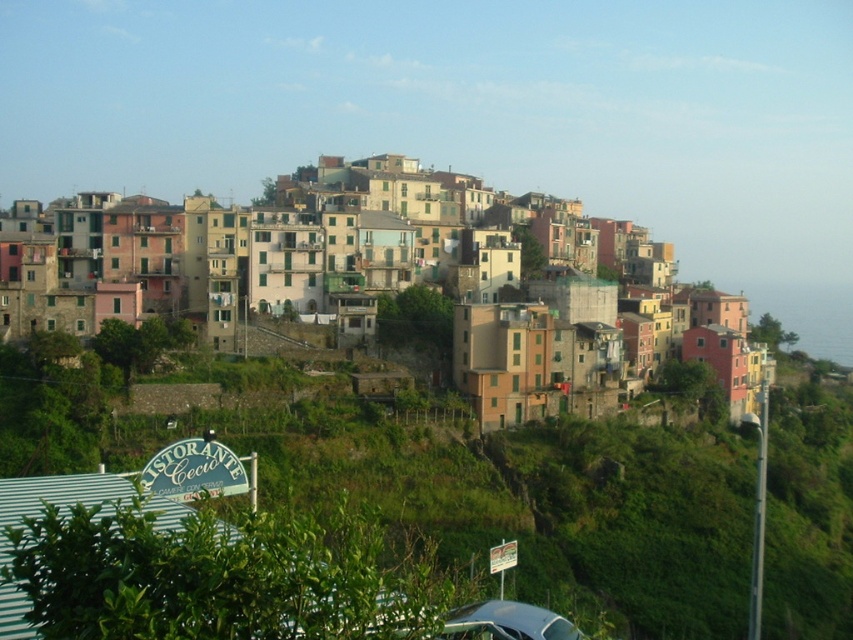
You are a tourist standing at the bottom of the hill looking up at the multicolored stone buildings at center and the metallic silver car at lower center. Which object is higher in elevation?

The multicolored stone buildings at center are higher in elevation than the metallic silver car at lower center because they are positioned over it.

You are standing in the hillside town and want to take a photo of both the point at coordinates (354,273) and the point at coordinates (578,632). Which point should you focus on first to ensure both are in focus?

You should focus on the point at coordinates (354,273) first because it is closer to the camera than the point at coordinates (578,632). This ensures both points will be in focus as the closer object sets the focal plane.

You are standing at the point labeled point (242, 248) in the hillside town. What is the closest object to you?

The point (242, 248) is on multicolored stone buildings at center, so the closest object to you is the multicolored stone buildings at center.